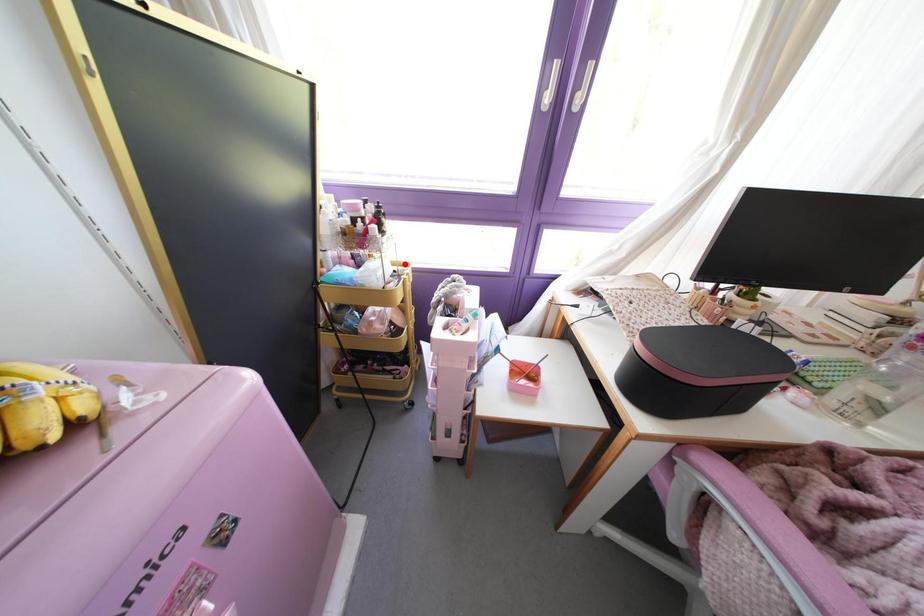
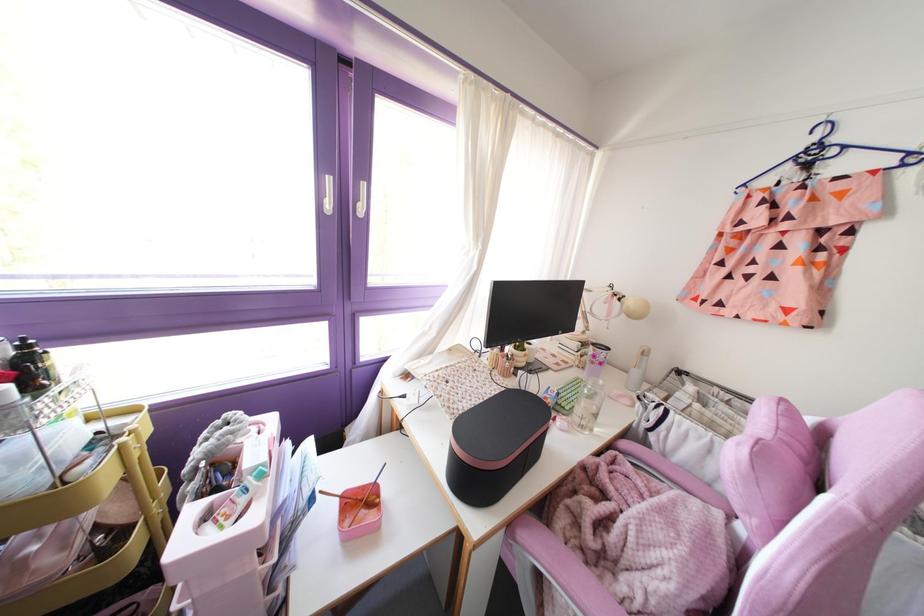
Locate, in the second image, the point that corresponds to the highlighted location in the first image.

(130, 411)